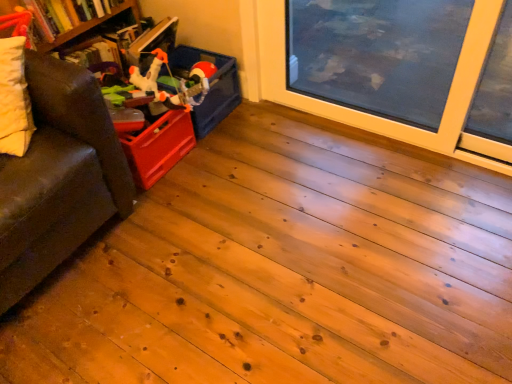
Question: Can you confirm if matte plastic toy at upper left is thinner than matte plastic storage box at upper left?

Choices:
 (A) yes
 (B) no

Answer: (A)

Question: Does matte plastic toy at upper left have a lesser height compared to matte plastic storage box at upper left?

Choices:
 (A) yes
 (B) no

Answer: (B)

Question: From a real-world perspective, does matte plastic toy at upper left stand above matte plastic storage box at upper left?

Choices:
 (A) yes
 (B) no

Answer: (A)

Question: From the image's perspective, is matte plastic toy at upper left under matte plastic storage box at upper left?

Choices:
 (A) yes
 (B) no

Answer: (B)

Question: Considering the relative positions of matte plastic toy at upper left and matte plastic storage box at upper left in the image provided, is matte plastic toy at upper left to the left of matte plastic storage box at upper left from the viewer's perspective?

Choices:
 (A) yes
 (B) no

Answer: (A)

Question: In terms of height, does brown leather couch at left look taller or shorter compared to wooden bookshelf at left?

Choices:
 (A) tall
 (B) short

Answer: (A)

Question: From the image's perspective, relative to wooden bookshelf at left, is brown leather couch at left above or below?

Choices:
 (A) above
 (B) below

Answer: (B)

Question: In the image, is brown leather couch at left on the left side or the right side of wooden bookshelf at left?

Choices:
 (A) right
 (B) left

Answer: (A)

Question: Is brown leather couch at left in front of or behind wooden bookshelf at left in the image?

Choices:
 (A) front
 (B) behind

Answer: (A)

Question: Based on their positions, is matte plastic storage box at upper left located to the left or right of wooden bookshelf at left?

Choices:
 (A) right
 (B) left

Answer: (A)

Question: Based on their sizes in the image, would you say matte plastic storage box at upper left is bigger or smaller than wooden bookshelf at left?

Choices:
 (A) big
 (B) small

Answer: (B)

Question: From a real-world perspective, is matte plastic storage box at upper left positioned above or below wooden bookshelf at left?

Choices:
 (A) below
 (B) above

Answer: (A)

Question: Relative to wooden bookshelf at left, is matte plastic storage box at upper left in front or behind?

Choices:
 (A) behind
 (B) front

Answer: (A)

Question: Looking at their shapes, would you say wooden bookshelf at left is wider or thinner than hardcover book at upper left?

Choices:
 (A) wide
 (B) thin

Answer: (B)

Question: In terms of size, does wooden bookshelf at left appear bigger or smaller than hardcover book at upper left?

Choices:
 (A) big
 (B) small

Answer: (A)